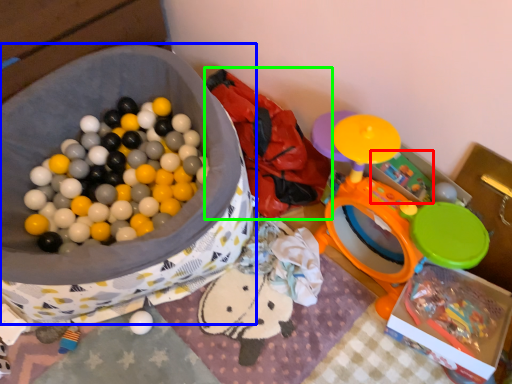
Question: Which object is positioned farthest from toy (highlighted by a red box)? Select from storage box (highlighted by a blue box) and bean bag chair (highlighted by a green box).

Choices:
 (A) storage box
 (B) bean bag chair

Answer: (A)